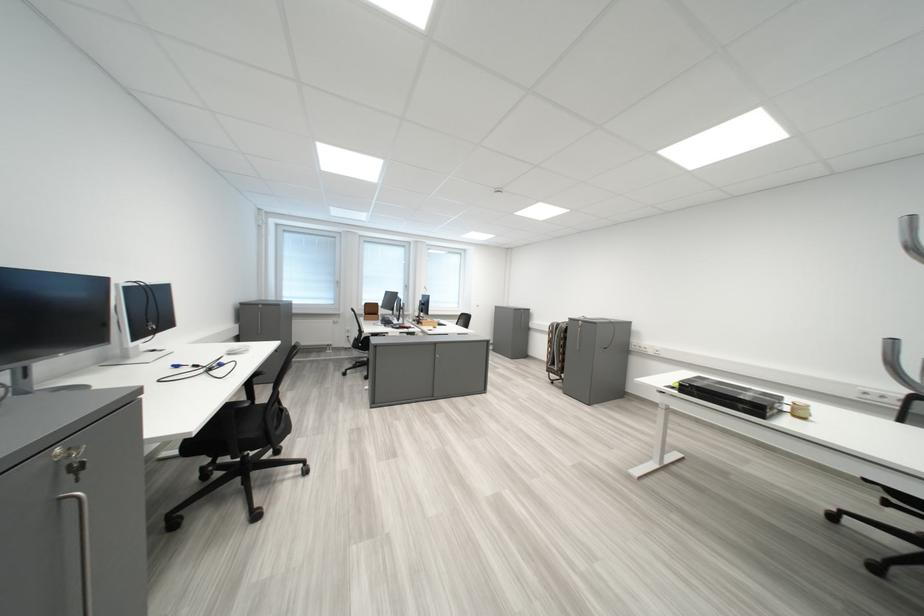
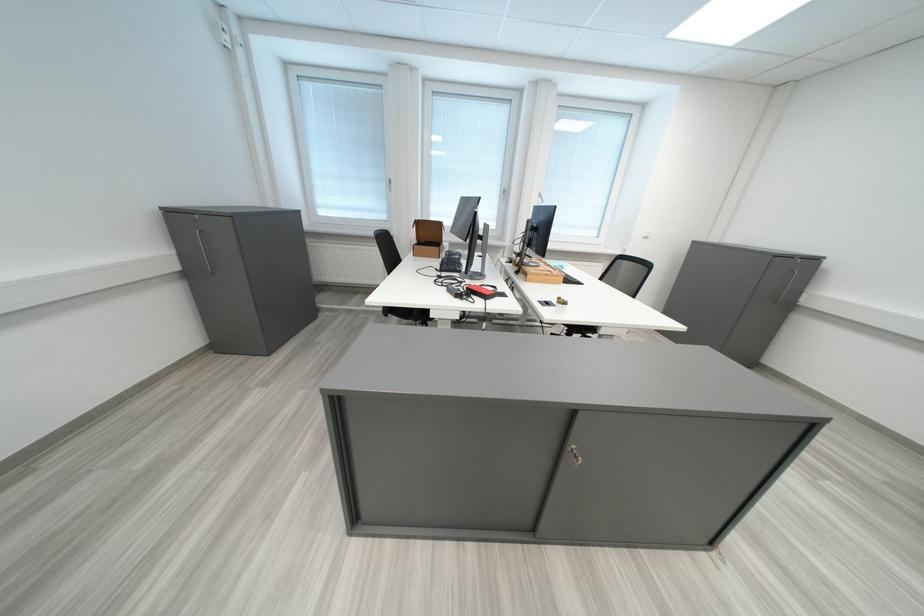
Where in the second image is the point corresponding to (x=434, y=325) from the first image?

(539, 276)